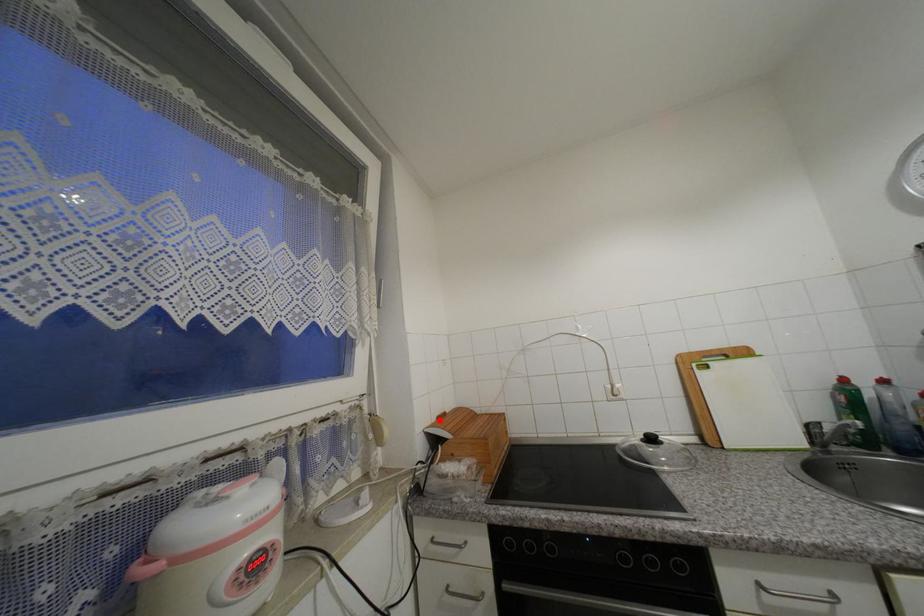
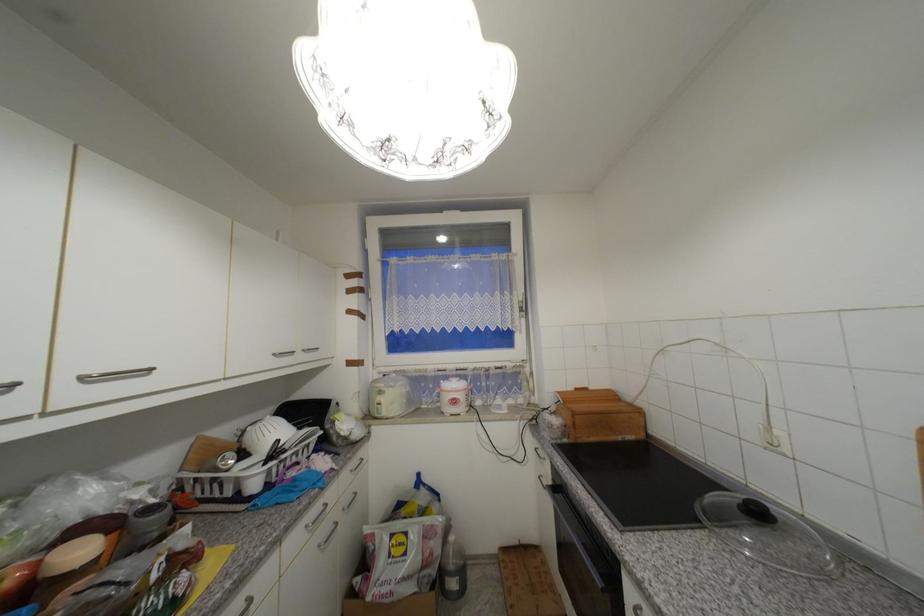
In the second image, find the point that corresponds to the highlighted location in the first image.

(576, 390)